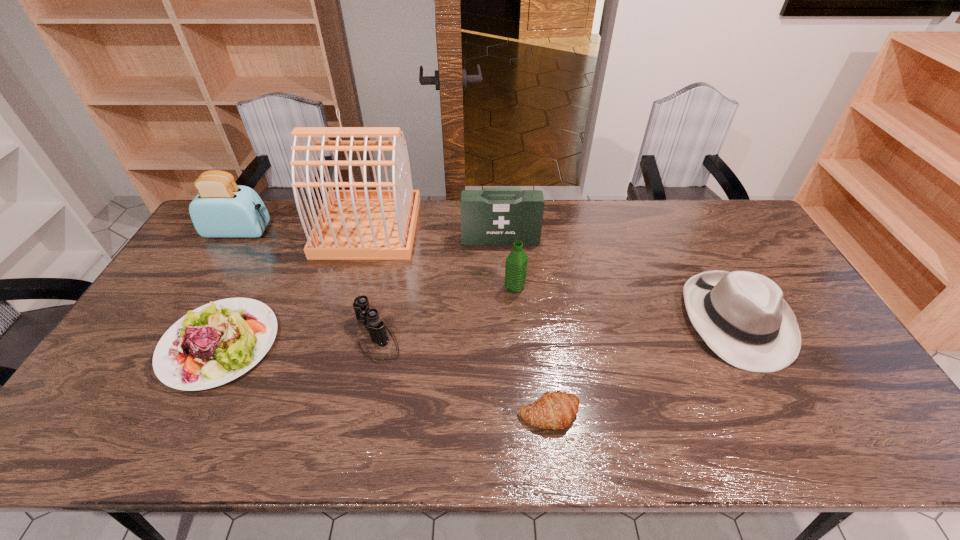
Identify the location of the tallest object. The image size is (960, 540). (378, 224).

Find the location of a particular element. The height and width of the screenshot is (540, 960). toaster is located at coordinates (222, 209).

At what (x,y) coordinates should I click in order to perform the action: click on the first-aid kit. Please return your answer as a coordinate pair (x, y). The height and width of the screenshot is (540, 960). Looking at the image, I should click on (493, 216).

The height and width of the screenshot is (540, 960). Identify the location of water bottle. (516, 263).

At what (x,y) coordinates should I click in order to perform the action: click on fedora. Please return your answer as a coordinate pair (x, y). This screenshot has width=960, height=540. Looking at the image, I should click on (742, 316).

This screenshot has height=540, width=960. Identify the location of the fifth tallest object. (742, 316).

Find the location of a particular element. the sixth tallest object is located at coordinates (369, 317).

The height and width of the screenshot is (540, 960). What are the coordinates of `salad plate` in the screenshot? It's located at (216, 343).

Image resolution: width=960 pixels, height=540 pixels. Identify the location of the nearest object. (555, 410).

Locate an element on the screen. crescent roll is located at coordinates (555, 410).